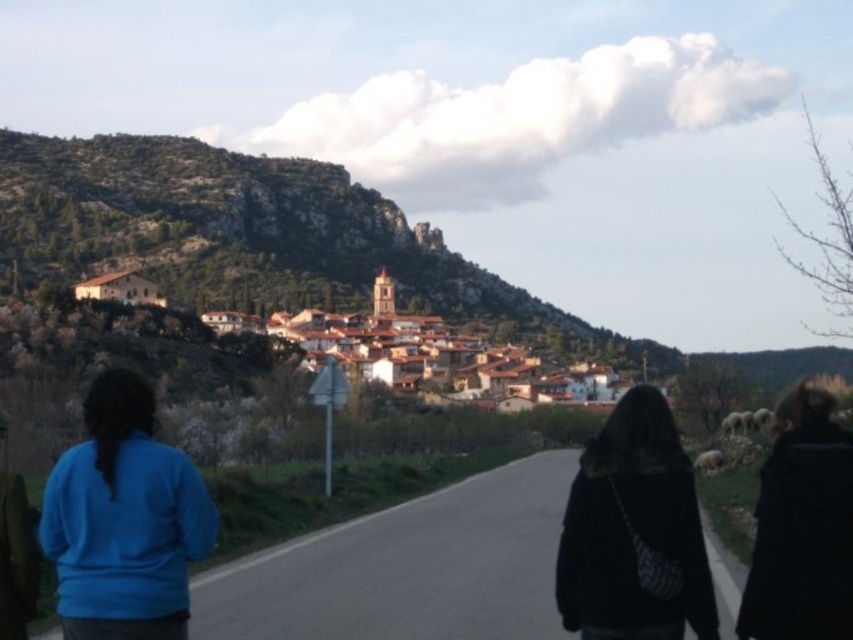
Who is positioned more to the left, brown rocky mountain at upper left or black fuzzy coat at lower right?

brown rocky mountain at upper left

Can you confirm if brown rocky mountain at upper left is smaller than black fuzzy coat at lower right?

Actually, brown rocky mountain at upper left might be larger than black fuzzy coat at lower right.

Describe the element at coordinates (260, 240) in the screenshot. I see `brown rocky mountain at upper left` at that location.

Image resolution: width=853 pixels, height=640 pixels. What are the coordinates of `brown rocky mountain at upper left` in the screenshot? It's located at [x=260, y=240].

Does brown rocky mountain at upper left appear under blue fleece jacket at lower left?

No, brown rocky mountain at upper left is not below blue fleece jacket at lower left.

Can you confirm if brown rocky mountain at upper left is positioned to the right of blue fleece jacket at lower left?

In fact, brown rocky mountain at upper left is to the left of blue fleece jacket at lower left.

Is point (506, 291) closer to viewer compared to point (180, 467)?

No.

This screenshot has width=853, height=640. What are the coordinates of `brown rocky mountain at upper left` in the screenshot? It's located at (260, 240).

Can you confirm if blue fleece jacket at lower left is positioned to the left of black fuzzy coat at lower right?

Indeed, blue fleece jacket at lower left is positioned on the left side of black fuzzy coat at lower right.

Who is more distant from viewer, (108,401) or (624,448)?

The point (624,448) is more distant.

Find the location of a particular element. This screenshot has height=640, width=853. blue fleece jacket at lower left is located at coordinates (125, 518).